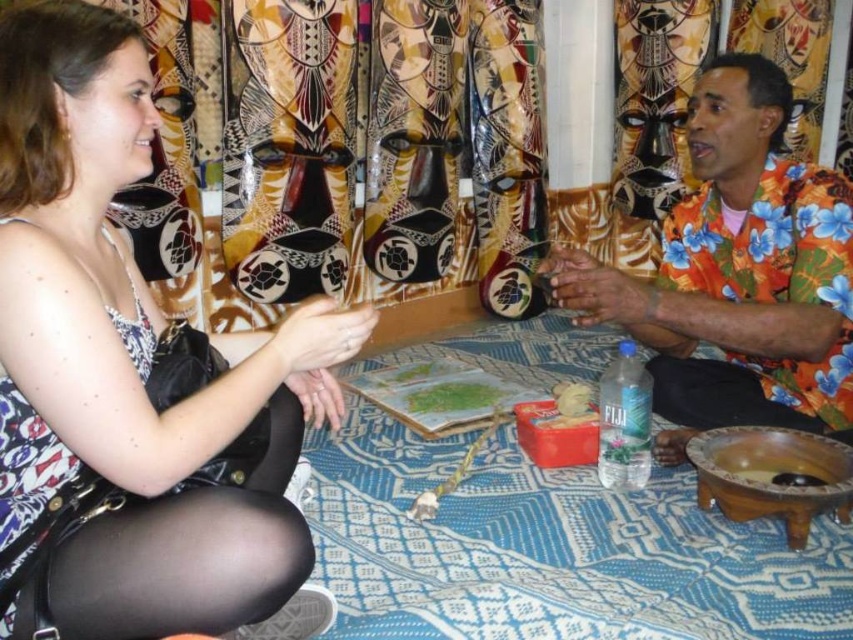
Who is positioned more to the right, matte black dress at left or orange floral shirt at right?

orange floral shirt at right is more to the right.

Is matte black dress at left below orange floral shirt at right?

Indeed, matte black dress at left is positioned under orange floral shirt at right.

Is point (212, 388) closer to viewer compared to point (763, 323)?

Yes, point (212, 388) is closer to viewer.

Where is `matte black dress at left`? This screenshot has width=853, height=640. matte black dress at left is located at coordinates pyautogui.click(x=131, y=374).

Does point (734, 412) come closer to viewer compared to point (474, 397)?

Yes, it is.

Which is in front, point (614, 310) or point (473, 400)?

Point (614, 310) is in front.

Between point (726, 141) and point (465, 400), which one is positioned in front?

Point (726, 141)

Locate an element on the screen. The height and width of the screenshot is (640, 853). orange floral shirt at right is located at coordinates (738, 273).

Measure the distance between point [175,580] and camera.

Point [175,580] is 39.15 inches away from camera.

The image size is (853, 640). Identify the location of matte black dress at left. (131, 374).